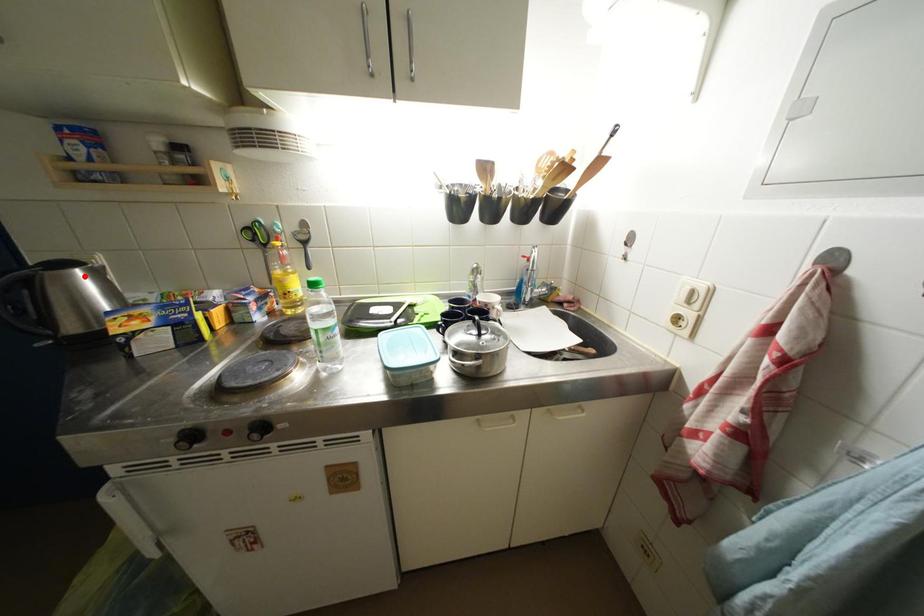
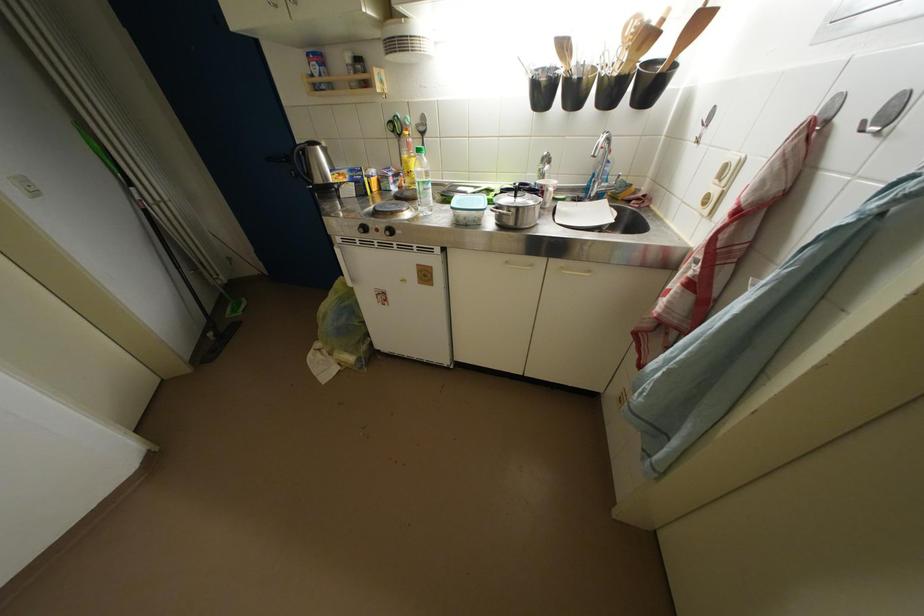
Question: I am providing you with two images of the same scene from different viewpoints. A red point is shown in image1. For the corresponding object point in image2, is it positioned nearer or farther from the camera?

Choices:
 (A) Nearer
 (B) Farther

Answer: (A)